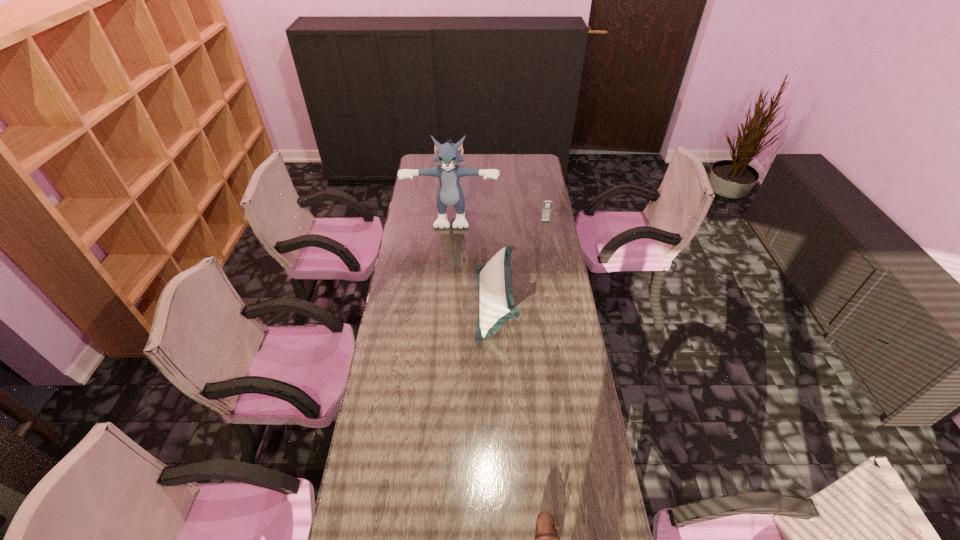
Locate an element on the screen. The image size is (960, 540). object that is at the left edge is located at coordinates (449, 193).

Locate an element on the screen. object at the right edge is located at coordinates (547, 204).

In the image, there is a desktop. Identify the location of vacant region at the far edge. The height and width of the screenshot is (540, 960). (498, 157).

In the image, there is a desktop. Find the location of `vacant space at the left edge`. vacant space at the left edge is located at coordinates point(429,231).

Image resolution: width=960 pixels, height=540 pixels. What are the coordinates of `free location at the right edge` in the screenshot? It's located at (559, 421).

The image size is (960, 540). What are the coordinates of `vacant space in between the cushion and the cat` in the screenshot? It's located at click(474, 259).

Where is `free space between the second shortest object and the cat`? The height and width of the screenshot is (540, 960). free space between the second shortest object and the cat is located at coordinates pos(499,218).

At what (x,y) coordinates should I click in order to perform the action: click on blank region between the second nearest object and the cat. Please return your answer as a coordinate pair (x, y). This screenshot has height=540, width=960. Looking at the image, I should click on (474, 259).

Locate an element on the screen. empty space between the cellular telephone and the cat is located at coordinates (499, 218).

Image resolution: width=960 pixels, height=540 pixels. What are the coordinates of `free point between the cat and the third farthest object` in the screenshot? It's located at tap(474, 259).